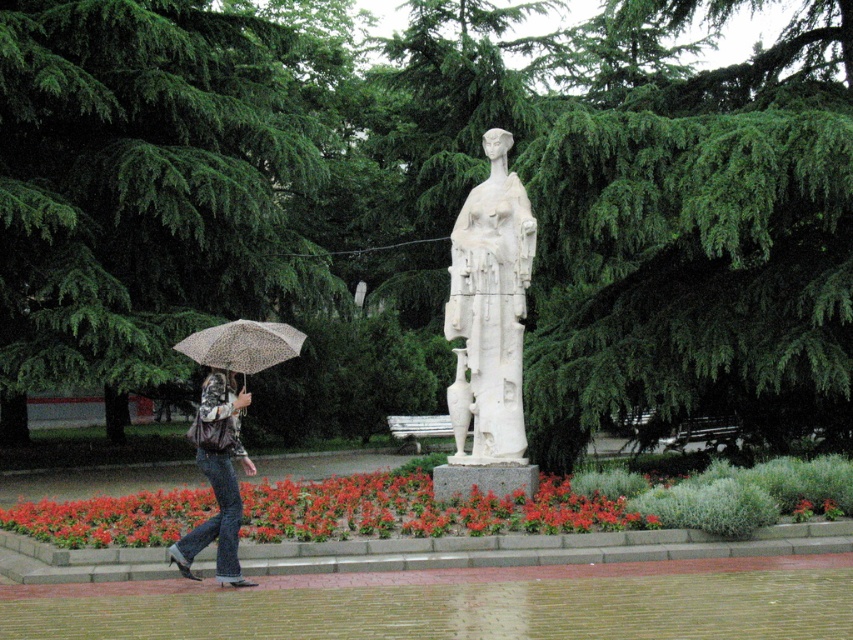
Question: Which object is farther from the camera taking this photo?

Choices:
 (A) green leafy tree at upper left
 (B) green leafy tree at center

Answer: (A)

Question: Is green leafy tree at upper left wider than spotted fabric umbrella at left?

Choices:
 (A) yes
 (B) no

Answer: (B)

Question: Which object appears closest to the camera in this image?

Choices:
 (A) green leafy tree at center
 (B) denim jeans at left
 (C) spotted fabric umbrella at left
 (D) green leafy tree at upper left

Answer: (B)

Question: Does white marble statue at center lie behind denim jeans at left?

Choices:
 (A) no
 (B) yes

Answer: (B)

Question: Which of the following is the farthest from the observer?

Choices:
 (A) spotted fabric umbrella at left
 (B) white marble statue at center
 (C) denim jeans at left

Answer: (B)

Question: Is green leafy tree at center closer to the viewer compared to green leafy tree at upper left?

Choices:
 (A) yes
 (B) no

Answer: (A)